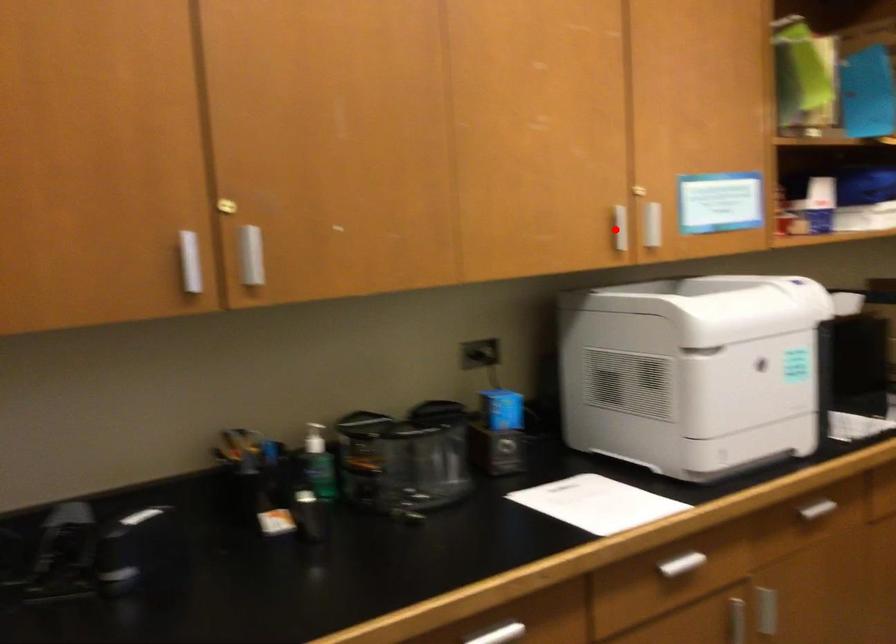
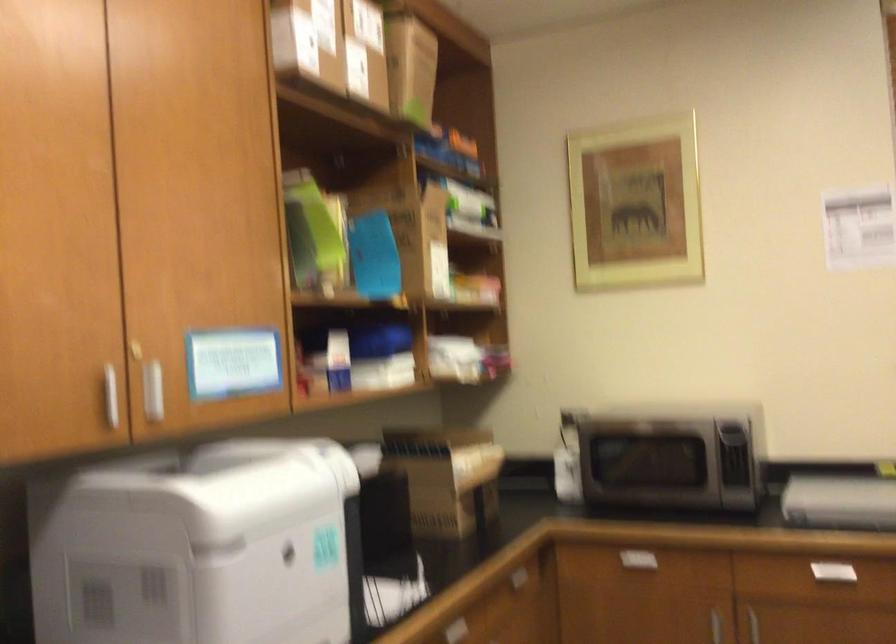
Question: I am providing you with two images of the same scene from different viewpoints. In image1, a red point is highlighted. Considering the same 3D point in image2, which of the following is correct?

Choices:
 (A) It is closer
 (B) It is farther

Answer: (A)